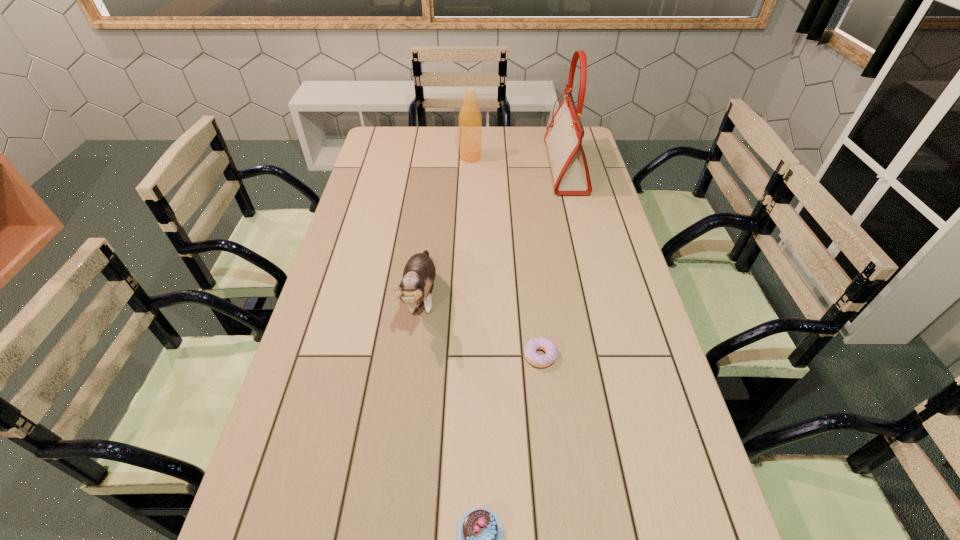
Identify the location of handbag. The width and height of the screenshot is (960, 540). (564, 135).

Locate an element on the screen. The image size is (960, 540). the tallest object is located at coordinates (564, 135).

Identify the location of the second tallest object. (470, 120).

Find the location of a particular element. the leftmost object is located at coordinates (419, 273).

Image resolution: width=960 pixels, height=540 pixels. Identify the location of cat. (419, 273).

Locate an element on the screen. The width and height of the screenshot is (960, 540). the second object from right to left is located at coordinates (532, 357).

In order to click on the shortest object in this screenshot , I will do `click(532, 357)`.

Identify the location of free region located 0.160m on the front of the rightmost object. (579, 225).

This screenshot has width=960, height=540. What are the coordinates of `vacant space situated on the right of the fourth shortest object` in the screenshot? It's located at (569, 157).

You are a GUI agent. You are given a task and a screenshot of the screen. Output one action in this format:
    pyautogui.click(x=<x>, y=<y>)
    Task: Click on the blank space located at the face of the third tallest object
    The image size is (960, 540).
    Given the screenshot: What is the action you would take?
    pyautogui.click(x=412, y=376)